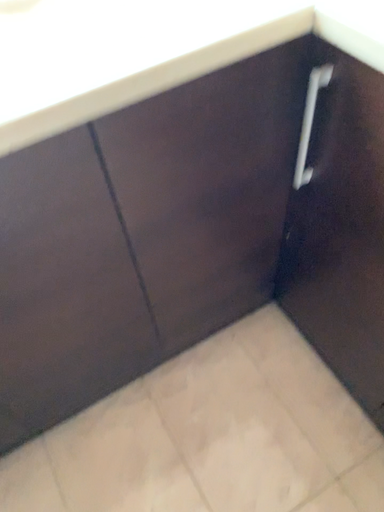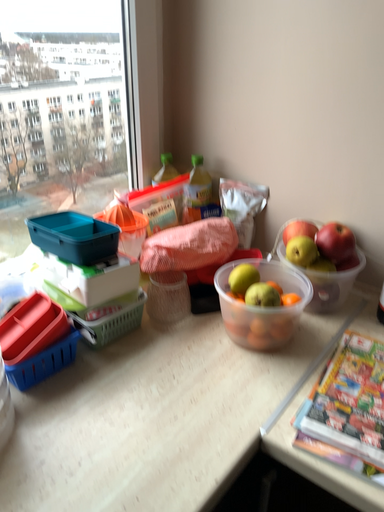
Question: Which way did the camera rotate in the video?

Choices:
 (A) rotated left
 (B) rotated right

Answer: (B)